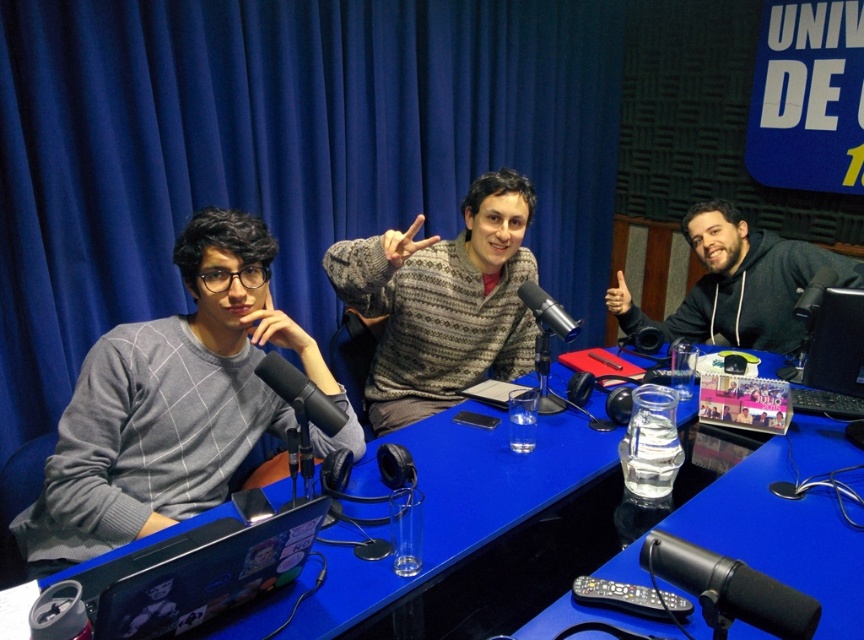
Image resolution: width=864 pixels, height=640 pixels. Identify the location of gray sweater at left. (169, 403).

Image resolution: width=864 pixels, height=640 pixels. What do you see at coordinates (169, 403) in the screenshot?
I see `gray sweater at left` at bounding box center [169, 403].

Find the location of a particular element. The height and width of the screenshot is (640, 864). gray sweater at left is located at coordinates (169, 403).

Can you confirm if black hoodie at right is bigger than black matte microphone at lower right?

Correct, black hoodie at right is larger in size than black matte microphone at lower right.

Between black hoodie at right and black matte microphone at lower right, which one is positioned lower?

black matte microphone at lower right is lower down.

Is point (677, 336) more distant than point (643, 563)?

Yes, it is behind point (643, 563).

I want to click on black hoodie at right, so click(738, 284).

Does black matte microphone at lower right appear on the right side of black plastic monitor at center right?

In fact, black matte microphone at lower right is to the left of black plastic monitor at center right.

Is black matte microphone at lower right wider than black plastic monitor at center right?

No, black matte microphone at lower right is not wider than black plastic monitor at center right.

What do you see at coordinates (729, 588) in the screenshot? The height and width of the screenshot is (640, 864). I see `black matte microphone at lower right` at bounding box center [729, 588].

Find the location of `black matte microphone at lower right`. black matte microphone at lower right is located at coordinates (729, 588).